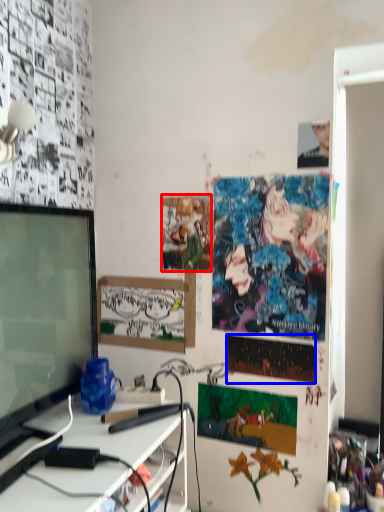
Question: Among these objects, which one is nearest to the camera, poster page (highlighted by a red box) or poster page (highlighted by a blue box)?

Choices:
 (A) poster page
 (B) poster page

Answer: (B)